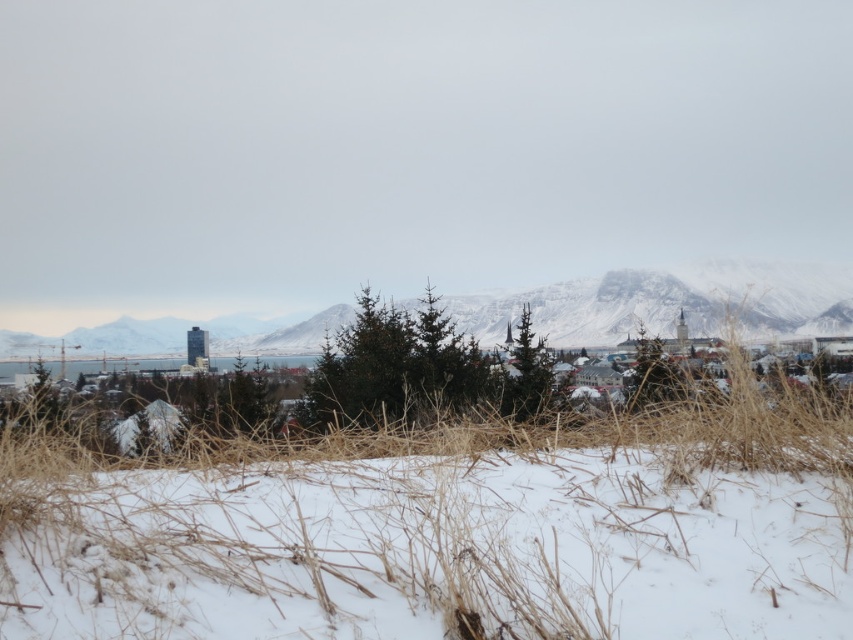
Which is in front, point (148, 472) or point (601, 310)?

Point (148, 472) is more forward.

In the scene shown: Which is more to the left, white dry grass at center or snowy rock formation at center?

From the viewer's perspective, white dry grass at center appears more on the left side.

Is point (830, 413) closer to viewer compared to point (729, 276)?

Yes, point (830, 413) is closer to viewer.

In order to click on white dry grass at center in this screenshot , I will do `click(450, 529)`.